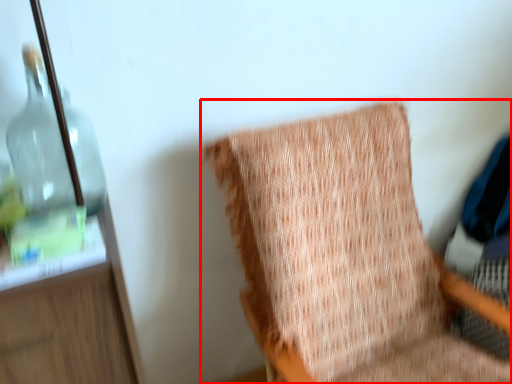
Question: From the image, what is the correct spatial relationship of chair (annotated by the red box) in relation to bottle?

Choices:
 (A) left
 (B) right

Answer: (B)